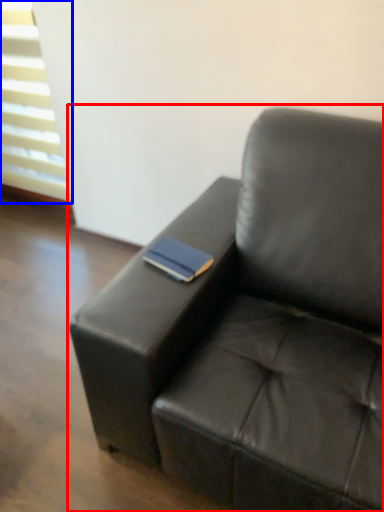
Question: Which point is closer to the camera, studio couch (highlighted by a red box) or window (highlighted by a blue box)?

Choices:
 (A) studio couch
 (B) window

Answer: (A)